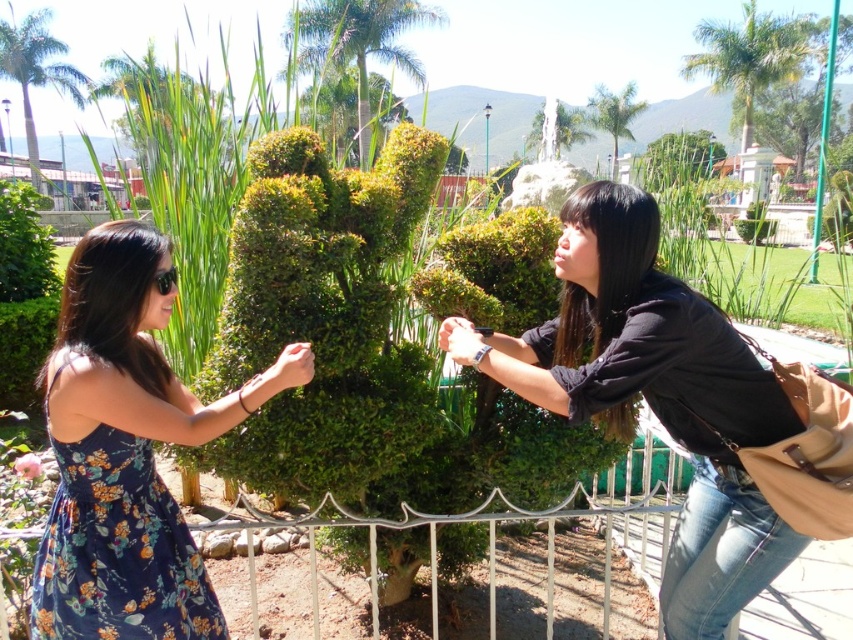
You are a photographer planning to take a group photo of the two people wearing the black matte shirt at center and floral dress at left. Considering their sizes, which person should be placed closer to the camera to ensure both appear equally sized in the photo?

The person wearing the black matte shirt at center should be placed further from the camera, while the one in the floral dress at left should be closer. Since the black matte shirt at center is larger, moving it back and bringing the floral dress at left forward will balance their apparent sizes in the photo.

You are a photographer trying to capture a photo of the black matte shirt at center and the pink matte flower at lower left. Which object should you focus on first if you want to ensure both are in focus, given that the camera can only focus on one point at a time?

You should focus on the black matte shirt at center first because it is above the pink matte flower at lower left, so focusing on the higher object will help keep both in focus.